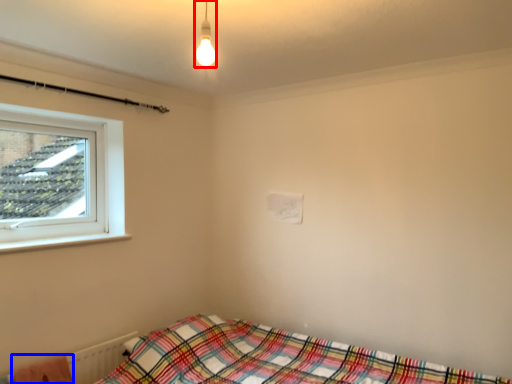
Question: Which point is further to the camera, light fixture (highlighted by a red box) or blanket (highlighted by a blue box)?

Choices:
 (A) light fixture
 (B) blanket

Answer: (B)